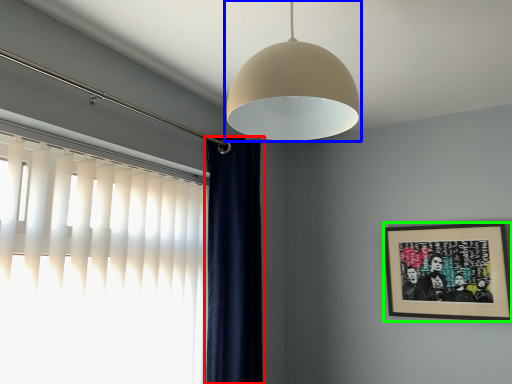
Question: Estimate the real-world distances between objects in this image. Which object is closer to curtain (highlighted by a red box), lamp (highlighted by a blue box) or picture frame (highlighted by a green box)?

Choices:
 (A) lamp
 (B) picture frame

Answer: (A)